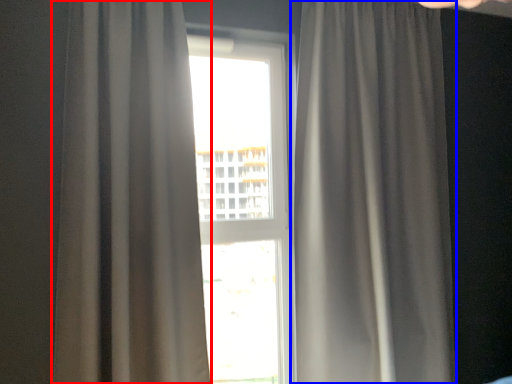
Question: Which point is closer to the camera, curtain (highlighted by a red box) or curtain (highlighted by a blue box)?

Choices:
 (A) curtain
 (B) curtain

Answer: (A)